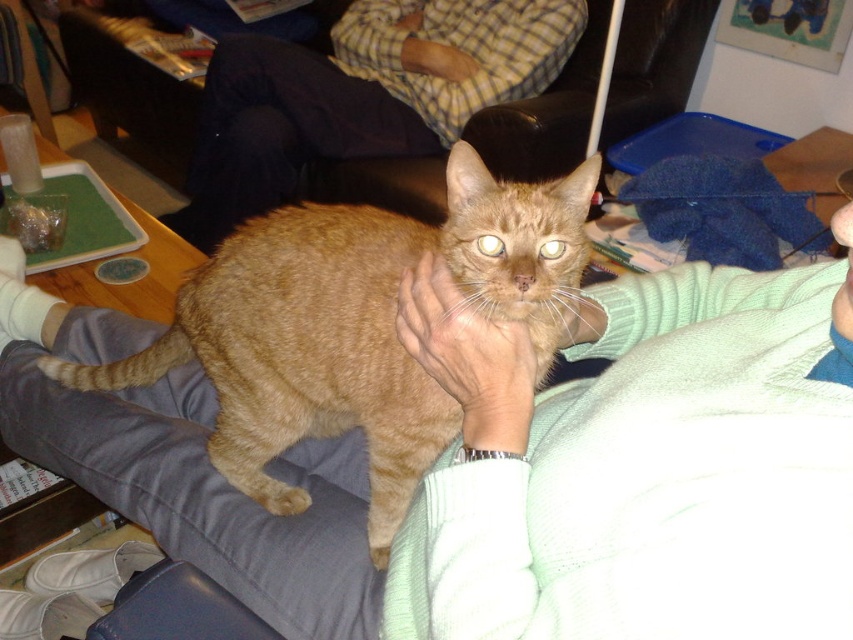
Question: Where is orange tabby cat at center located in relation to checkered shirt at upper center in the image?

Choices:
 (A) right
 (B) left

Answer: (A)

Question: Can you confirm if orange tabby cat at center is positioned to the left of checkered shirt at upper center?

Choices:
 (A) yes
 (B) no

Answer: (B)

Question: Does orange tabby cat at center have a larger size compared to checkered shirt at upper center?

Choices:
 (A) no
 (B) yes

Answer: (A)

Question: Which point is closer to the camera?

Choices:
 (A) (247, 410)
 (B) (335, 38)

Answer: (A)

Question: Which point is farther from the camera taking this photo?

Choices:
 (A) [x=59, y=365]
 (B) [x=503, y=51]

Answer: (B)